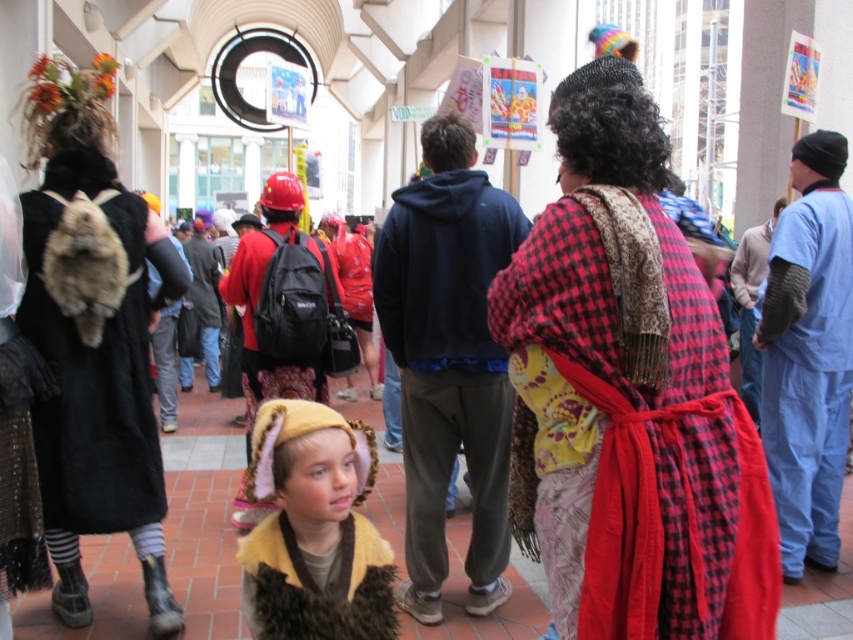
Does red plaid dress at center have a larger size compared to red plaid robe at center?

Yes, red plaid dress at center is bigger than red plaid robe at center.

Does red plaid dress at center have a smaller size compared to red plaid robe at center?

Actually, red plaid dress at center might be larger than red plaid robe at center.

Is point (514, 465) positioned in front of point (473, 545)?

That is True.

Identify the location of red plaid dress at center. The width and height of the screenshot is (853, 640). (630, 403).

Does point (734, 616) come behind point (740, 305)?

No, it is in front of (740, 305).

Does red plaid dress at center have a greater width compared to red plaid robe at right?

Correct, the width of red plaid dress at center exceeds that of red plaid robe at right.

I want to click on red plaid dress at center, so click(x=630, y=403).

Where is `red plaid dress at center`? red plaid dress at center is located at coordinates (630, 403).

Which is more to the left, fuzzy black coat at left or fuzzy yellow hat at center?

Positioned to the left is fuzzy black coat at left.

Image resolution: width=853 pixels, height=640 pixels. Find the location of `fuzzy black coat at left`. fuzzy black coat at left is located at coordinates (96, 353).

Identify the location of fuzzy black coat at left. (96, 353).